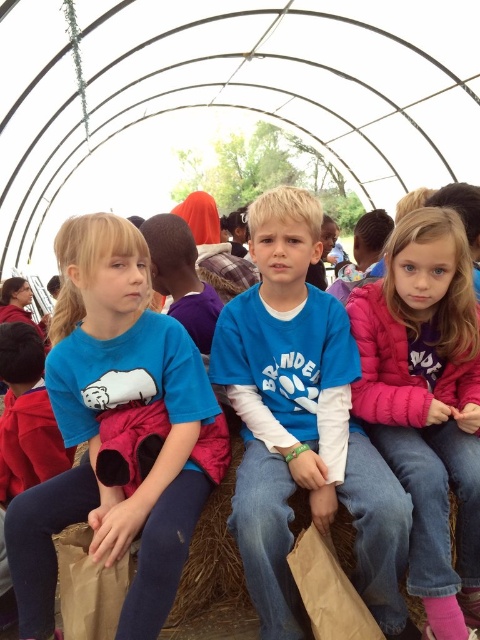
Question: Which point is farther to the camera?

Choices:
 (A) blue cotton shirt at center
 (B) matte blue t-shirt at center
 (C) brown paper bag at lower left

Answer: (C)

Question: Which point is closer to the camera taking this photo?

Choices:
 (A) (85, 634)
 (B) (457, 218)

Answer: (A)

Question: Which point appears closest to the camera in this image?

Choices:
 (A) (148, 509)
 (B) (324, 548)
 (C) (74, 566)

Answer: (B)

Question: Does pink fleece jacket at center have a larger size compared to brown paper bag at center?

Choices:
 (A) yes
 (B) no

Answer: (A)

Question: Can you confirm if pink fleece jacket at center is positioned above brown paper bag at lower left?

Choices:
 (A) yes
 (B) no

Answer: (A)

Question: Where is matte blue t-shirt at center located in relation to pink fleece jacket at center in the image?

Choices:
 (A) below
 (B) above

Answer: (A)